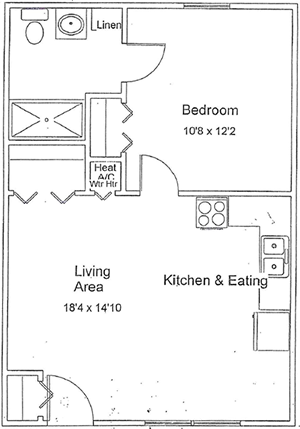
Identify the location of bedroom. (203, 124).